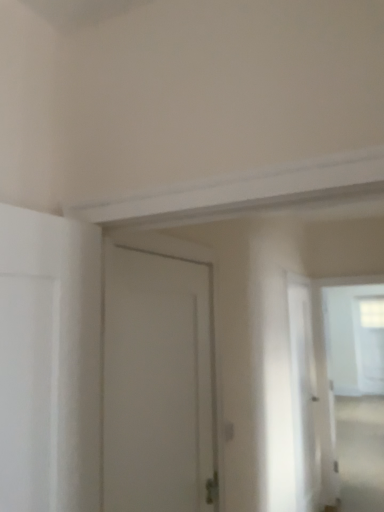
Question: Is transparent plastic screen door at right thinner than white matte door at center?

Choices:
 (A) no
 (B) yes

Answer: (A)

Question: Can you confirm if transparent plastic screen door at right is smaller than white matte door at center?

Choices:
 (A) no
 (B) yes

Answer: (A)

Question: From the image's perspective, is transparent plastic screen door at right beneath white matte door at center?

Choices:
 (A) no
 (B) yes

Answer: (B)

Question: Is white matte door at center located within transparent plastic screen door at right?

Choices:
 (A) yes
 (B) no

Answer: (B)

Question: Is the depth of transparent plastic screen door at right greater than that of white matte door at center?

Choices:
 (A) yes
 (B) no

Answer: (A)

Question: Does transparent plastic screen door at right have a larger size compared to white matte door at center?

Choices:
 (A) yes
 (B) no

Answer: (A)

Question: Is transparent plastic screen door at right not inside transparent glass window at upper right?

Choices:
 (A) yes
 (B) no

Answer: (A)

Question: Does transparent plastic screen door at right appear on the left side of transparent glass window at upper right?

Choices:
 (A) no
 (B) yes

Answer: (B)

Question: Is transparent plastic screen door at right touching transparent glass window at upper right?

Choices:
 (A) no
 (B) yes

Answer: (A)

Question: Could you tell me if transparent plastic screen door at right is facing transparent glass window at upper right?

Choices:
 (A) no
 (B) yes

Answer: (A)

Question: Does transparent plastic screen door at right have a greater width compared to transparent glass window at upper right?

Choices:
 (A) yes
 (B) no

Answer: (B)

Question: From a real-world perspective, is transparent plastic screen door at right beneath transparent glass window at upper right?

Choices:
 (A) no
 (B) yes

Answer: (B)

Question: Is white matte door at center aimed at transparent glass window at upper right?

Choices:
 (A) no
 (B) yes

Answer: (A)